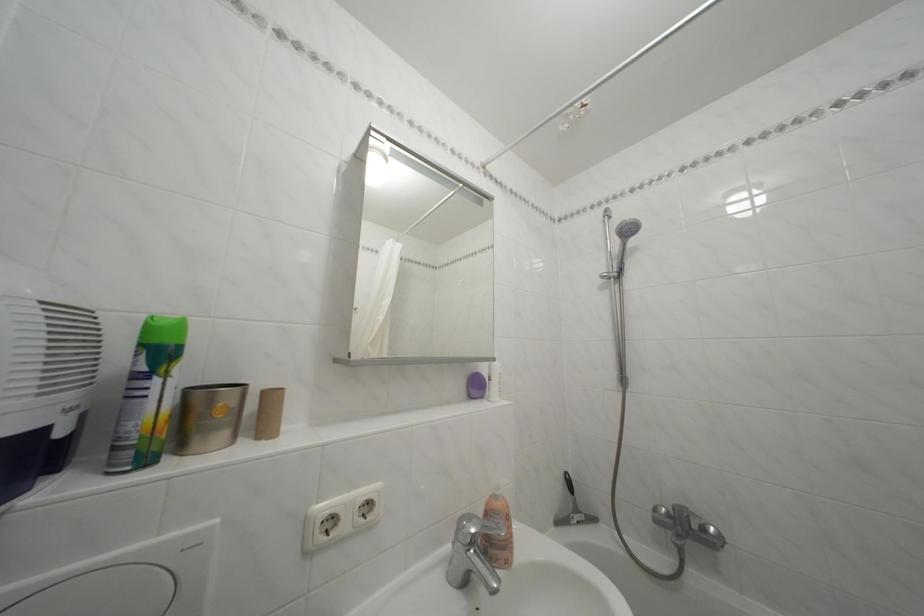
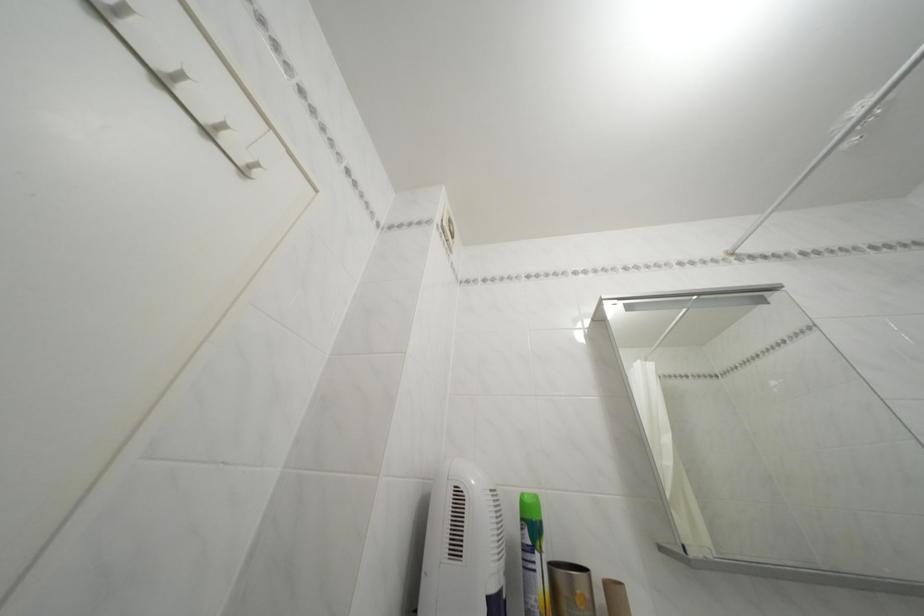
How did the camera likely rotate?

The camera rotated toward left-up.